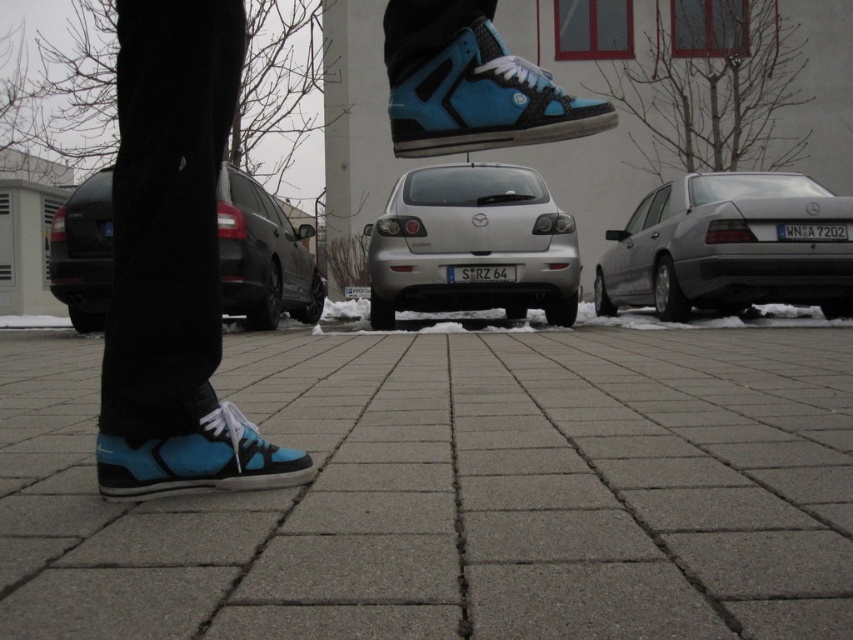
Between matte blue sneakers at lower left and black matte car at center, which one has more height?

black matte car at center is taller.

Who is lower down, matte blue sneakers at lower left or black matte car at center?

Positioned lower is matte blue sneakers at lower left.

Is point (506, 81) positioned behind point (247, 260)?

No, (506, 81) is in front of (247, 260).

I want to click on matte blue sneakers at lower left, so click(x=173, y=262).

Find the location of a particular element. Image resolution: width=853 pixels, height=640 pixels. gray concrete pavement at lower center is located at coordinates (457, 492).

Image resolution: width=853 pixels, height=640 pixels. What do you see at coordinates (457, 492) in the screenshot?
I see `gray concrete pavement at lower center` at bounding box center [457, 492].

Where is `gray concrete pavement at lower center`? The height and width of the screenshot is (640, 853). gray concrete pavement at lower center is located at coordinates (457, 492).

Which is in front, point (535, 179) or point (548, 138)?

Point (548, 138) is more forward.

Does silver metallic hatchback at center come in front of matte blue canvas shoe at lower left?

That is False.

Which is in front, point (471, 230) or point (436, 92)?

Positioned in front is point (436, 92).

This screenshot has width=853, height=640. I want to click on silver metallic hatchback at center, so click(x=473, y=244).